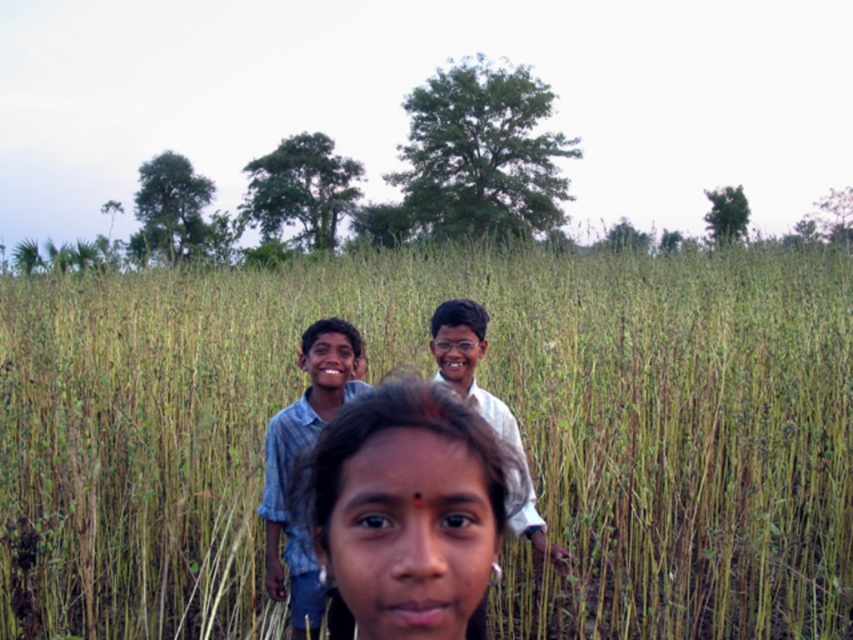
You are a photographer trying to frame a shot of the smooth skin face at center and the blue denim shirt at center. Which object should you focus on if you want to capture the wider one in your frame?

The blue denim shirt at center is wider than the smooth skin face at center, so you should focus on the blue denim shirt at center to capture the wider one in your frame.

You are a photographer trying to adjust the lighting for a group photo. You notice two subjects in the scene. The first is the smooth skin face at center, and the second is the blue denim shirt at center. Which subject is positioned to the right side of the other?

The smooth skin face at center is to the right of the blue denim shirt at center.

You are a photographer trying to capture a photo of the children in the field. You want to ensure the green grass at center and the blue denim shirt at center are both visible in the frame. Based on their positions, which object should be placed to the left side of the camera frame?

The green grass at center should be placed to the left side of the camera frame since it is to the left of the blue denim shirt at center.